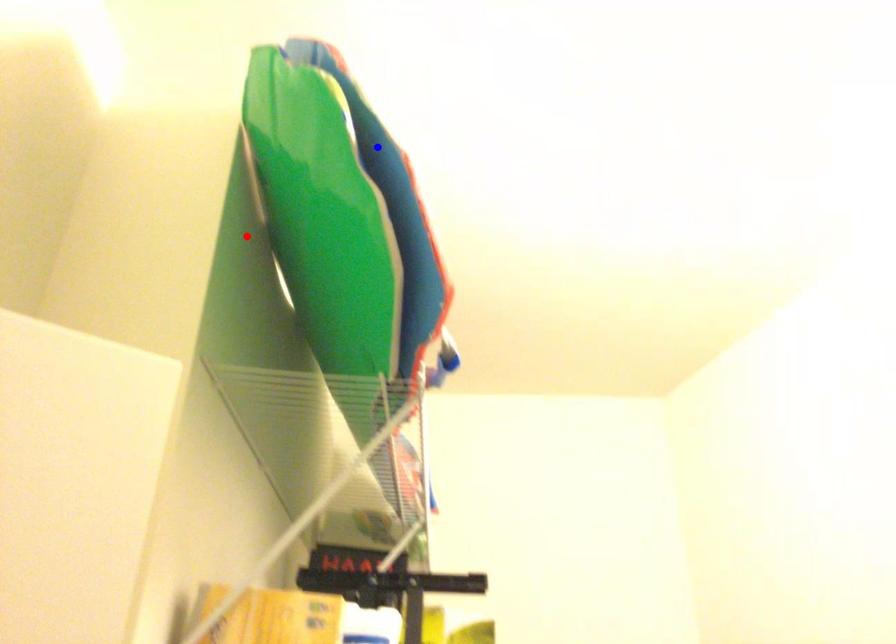
Question: In the image, two points are highlighted. Which point is nearer to the camera? Reply with the corresponding letter.

Choices:
 (A) blue point
 (B) red point

Answer: (A)